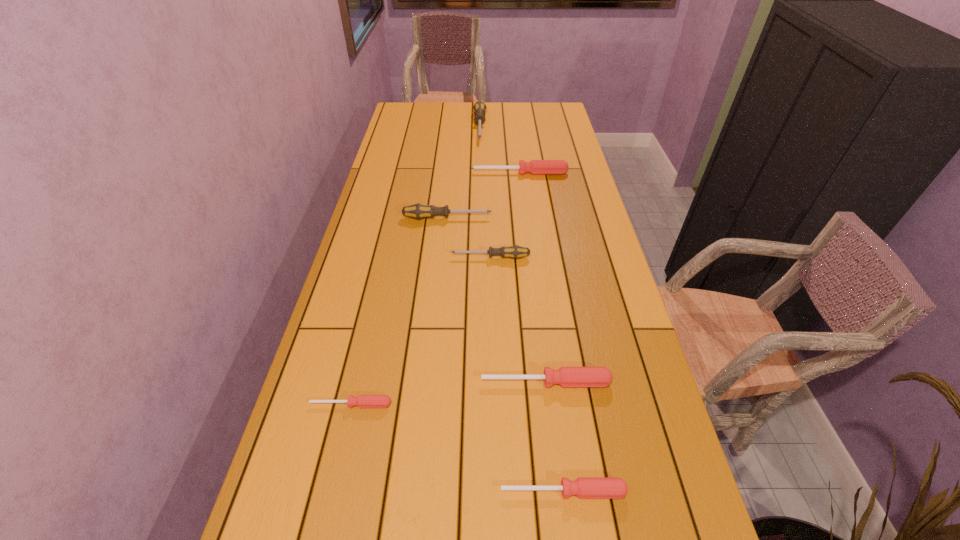
The width and height of the screenshot is (960, 540). Identify the location of the second smallest red screwdriver. (583, 487).

Identify the location of the sixth tallest screwdriver. The width and height of the screenshot is (960, 540). (583, 487).

Find the location of a particular element. the sixth farthest screwdriver is located at coordinates (362, 401).

Find the location of a particular element. The height and width of the screenshot is (540, 960). the second nearest object is located at coordinates (362, 401).

This screenshot has width=960, height=540. What are the coordinates of `vacant region located 0.150m at the tip of the farthest gray screwdriver` in the screenshot? It's located at (480, 164).

What are the coordinates of `vacant area situated 0.350m at the tip of the second nearest gray screwdriver` in the screenshot? It's located at (596, 218).

At what (x,y) coordinates should I click in order to perform the action: click on blank space located 0.230m on the front of the sixth nearest screwdriver. Please return your answer as a coordinate pair (x, y). This screenshot has width=960, height=540. Looking at the image, I should click on (525, 212).

The width and height of the screenshot is (960, 540). I want to click on free spot located 0.260m at the tip of the nearest gray screwdriver, so click(x=365, y=257).

At what (x,y) coordinates should I click in order to perform the action: click on vacant region located at the tip of the nearest gray screwdriver. Please return your answer as a coordinate pair (x, y). The height and width of the screenshot is (540, 960). Looking at the image, I should click on (352, 257).

Locate an element on the screen. This screenshot has width=960, height=540. vacant space situated 0.100m at the tip of the nearest gray screwdriver is located at coordinates click(418, 257).